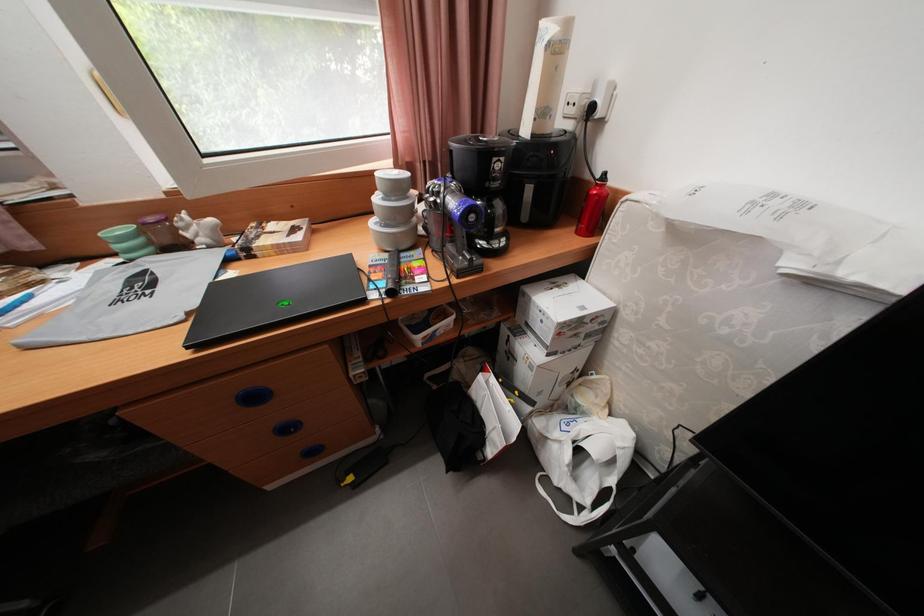
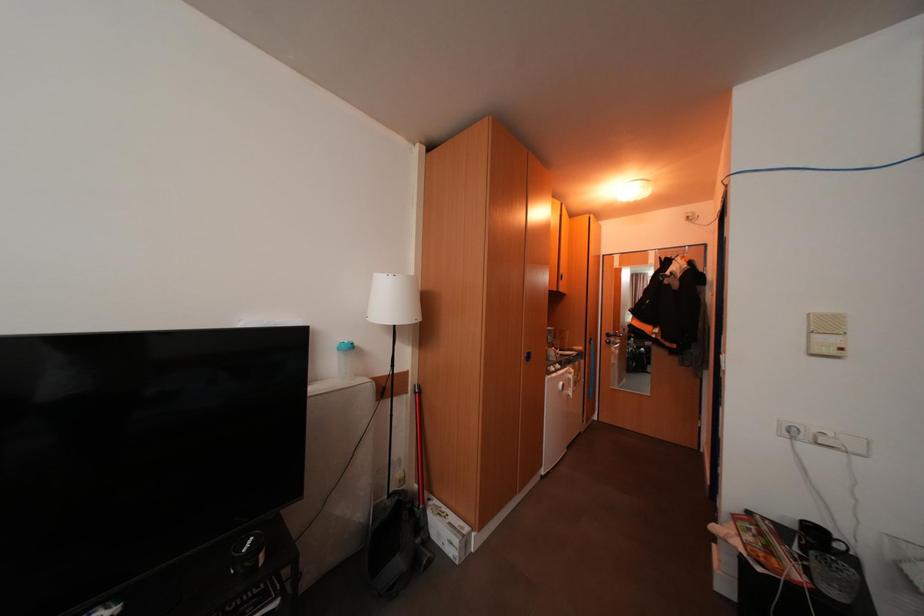
Question: The camera is either moving clockwise (left) or counter-clockwise (right) around the object. The first image is from the beginning of the video and the second image is from the end. Is the camera moving left or right when shooting the video?

Choices:
 (A) Left
 (B) Right

Answer: (A)